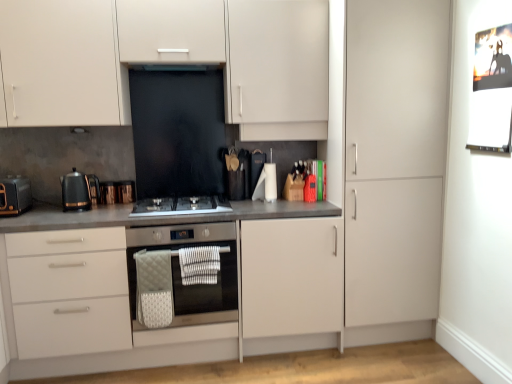
I want to click on copper metallic kettle at center-left, the first appliance from the right, so click(x=126, y=191).

Describe the element at coordinates (180, 272) in the screenshot. I see `stainless steel oven at center` at that location.

The width and height of the screenshot is (512, 384). I want to click on matte black toaster at left, the first kitchen appliance when ordered from left to right, so click(15, 196).

This screenshot has height=384, width=512. Describe the element at coordinates (395, 158) in the screenshot. I see `matte white cabinet at right` at that location.

The image size is (512, 384). What do you see at coordinates (181, 205) in the screenshot? I see `black glass gas stove at center` at bounding box center [181, 205].

Find the location of `black glass exhaust hood at upper center`. black glass exhaust hood at upper center is located at coordinates (175, 67).

Can you tell me how much white textured cloth at lower center and metallic silver bulletin board at upper right differ in facing direction?

There is a 90.8-degree angle between the facing directions of white textured cloth at lower center and metallic silver bulletin board at upper right.

From the image's perspective, which one is positioned higher, white textured cloth at lower center or metallic silver bulletin board at upper right?

metallic silver bulletin board at upper right, from the image's perspective.

Does white textured cloth at lower center appear on the right side of metallic silver bulletin board at upper right?

Incorrect, white textured cloth at lower center is not on the right side of metallic silver bulletin board at upper right.

Does white textured cloth at lower center have a greater width compared to metallic silver bulletin board at upper right?

Yes, white textured cloth at lower center is wider than metallic silver bulletin board at upper right.

Looking at this image, from the image's perspective, which one is positioned lower, white textured cloth at lower center or matte white cabinet at right?

white textured cloth at lower center is shown below in the image.

Can you confirm if white textured cloth at lower center is positioned to the right of matte white cabinet at right?

No, white textured cloth at lower center is not to the right of matte white cabinet at right.

Is point (190, 271) farther from camera compared to point (406, 14)?

No, it is in front of (406, 14).

Is white textured cloth at lower center closer to the viewer compared to matte white cabinet at right?

No, it is not.

You are a GUI agent. You are given a task and a screenshot of the screen. Output one action in this format:
    pyautogui.click(x=<x>, y=<y>)
    Task: Click on the 1st kitchen appliance to the left of the black glass gas stove at center, starting your count from the anchor
    
    Given the screenshot: What is the action you would take?
    pyautogui.click(x=78, y=191)

Is black plastic kettle at left, the 1th kitchen appliance when ordered from right to left, positioned with its back to black glass gas stove at center?

No, black glass gas stove at center is not at the back of black plastic kettle at left, the 1th kitchen appliance when ordered from right to left.

Which point is more distant from viewer, (70, 173) or (158, 200)?

The point (158, 200) is behind.

Which is in front, point (134, 195) or point (208, 67)?

Point (208, 67)

Is copper metallic kettle at center-left, arranged as the second appliance when viewed from the left, turned away from black glass exhaust hood at upper center?

No, copper metallic kettle at center-left, arranged as the second appliance when viewed from the left,'s orientation is not away from black glass exhaust hood at upper center.

Considering the sizes of objects copper metallic kettle at center-left, the first appliance from the right, and black glass exhaust hood at upper center in the image provided, who is bigger, copper metallic kettle at center-left, the first appliance from the right, or black glass exhaust hood at upper center?

With larger size is black glass exhaust hood at upper center.

How different are the orientations of copper metallic kettle at center-left, arranged as the second appliance when viewed from the left, and black glass exhaust hood at upper center in degrees?

1.32 degrees separate the facing orientations of copper metallic kettle at center-left, arranged as the second appliance when viewed from the left, and black glass exhaust hood at upper center.

I want to click on cloth in front of the matte black toaster at left, arranged as the second kitchen appliance when viewed from the right, so click(199, 265).

From the image's perspective, which is below, white textured cloth at lower center or matte black toaster at left, the first kitchen appliance when ordered from left to right?

white textured cloth at lower center, from the image's perspective.

Can you confirm if white textured cloth at lower center is wider than matte black toaster at left, arranged as the second kitchen appliance when viewed from the right?

In fact, white textured cloth at lower center might be narrower than matte black toaster at left, arranged as the second kitchen appliance when viewed from the right.

Between white textured cloth at lower center and matte black toaster at left, arranged as the second kitchen appliance when viewed from the right, which one appears on the right side from the viewer's perspective?

white textured cloth at lower center.

Considering the positions of point (120, 209) and point (481, 66), is point (120, 209) closer or farther from the camera than point (481, 66)?

Clearly, point (120, 209) is more distant from the camera than point (481, 66).

Would you say matte gray countertop at center is a long distance from metallic silver bulletin board at upper right?

Yes.

Consider the image. From the image's perspective, which one is positioned higher, matte gray countertop at center or metallic silver bulletin board at upper right?

metallic silver bulletin board at upper right, from the image's perspective.

From a real-world perspective, is matte gray countertop at center positioned under metallic silver bulletin board at upper right based on gravity?

Correct, in the physical world, matte gray countertop at center is lower than metallic silver bulletin board at upper right.

From a real-world perspective, which is physically above, matte black toaster at left, the first kitchen appliance when ordered from left to right, or stainless steel oven at center?

From a 3D spatial view, matte black toaster at left, the first kitchen appliance when ordered from left to right, is above.

From the image's perspective, which is above, matte black toaster at left, the first kitchen appliance when ordered from left to right, or stainless steel oven at center?

From the image's view, matte black toaster at left, the first kitchen appliance when ordered from left to right, is above.

Looking at this image, is the surface of matte black toaster at left, the first kitchen appliance when ordered from left to right, in direct contact with stainless steel oven at center?

matte black toaster at left, the first kitchen appliance when ordered from left to right, and stainless steel oven at center are not in contact.

Does matte black toaster at left, arranged as the second kitchen appliance when viewed from the right, have a larger size compared to stainless steel oven at center?

Actually, matte black toaster at left, arranged as the second kitchen appliance when viewed from the right, might be smaller than stainless steel oven at center.

Locate an element on the screen. cloth on the left of the metallic silver bulletin board at upper right is located at coordinates (199, 265).

The height and width of the screenshot is (384, 512). Identify the location of cloth below the matte white cabinet at right (from the image's perspective). (199, 265).

Which object lies nearer to the anchor point black glass gas stove at center, matte white cabinets at upper center or black glass exhaust hood at upper center?

matte white cabinets at upper center is closer to black glass gas stove at center.

When comparing their distances from black glass gas stove at center, does stainless steel oven at center or matte white cabinet at right seem further?

matte white cabinet at right.

Which object lies further to the anchor point matte white cabinets at upper center, copper metallic kettle at center-left, the first appliance from the right, or stainless steel oven at center?

Among the two, copper metallic kettle at center-left, the first appliance from the right, is located further to matte white cabinets at upper center.

Consider the image. Which object lies nearer to the anchor point matte white cabinet at right, copper metallic toaster at left, the 1th appliance viewed from the left, or matte black toaster at left, the first kitchen appliance when ordered from left to right?

copper metallic toaster at left, the 1th appliance viewed from the left, is closer to matte white cabinet at right.

From the image, which object appears to be nearer to matte white cabinets at upper center, matte black toaster at left, arranged as the second kitchen appliance when viewed from the right, or metallic silver bulletin board at upper right?

Based on the image, matte black toaster at left, arranged as the second kitchen appliance when viewed from the right, appears to be nearer to matte white cabinets at upper center.

Looking at the image, which one is located closer to black glass gas stove at center, matte white cabinet at right or metallic silver bulletin board at upper right?

matte white cabinet at right is closer to black glass gas stove at center.

From the image, which object appears to be nearer to matte white cabinet at right, black plastic kettle at left, acting as the 2th kitchen appliance starting from the left, or stainless steel oven at center?

stainless steel oven at center is positioned closer to the anchor matte white cabinet at right.

Based on the photo, considering their positions, is matte gray countertop at center positioned further to matte white cabinets at upper center than copper metallic toaster at left, the 2th appliance viewed from the right?

The object further to matte white cabinets at upper center is copper metallic toaster at left, the 2th appliance viewed from the right.

Locate an element on the screen. Image resolution: width=512 pixels, height=384 pixels. exhaust hood between matte black toaster at left, the first kitchen appliance when ordered from left to right, and black glass gas stove at center from left to right is located at coordinates (175, 67).

Locate an element on the screen. Image resolution: width=512 pixels, height=384 pixels. cloth located between matte black toaster at left, the first kitchen appliance when ordered from left to right, and metallic silver bulletin board at upper right in the left-right direction is located at coordinates (199, 265).

Identify the location of kitchen appliance between matte black toaster at left, arranged as the second kitchen appliance when viewed from the right, and matte white cabinet at right from left to right. The image size is (512, 384). (78, 191).

Identify the location of kitchen appliance between matte black toaster at left, the first kitchen appliance when ordered from left to right, and black glass gas stove at center, in the horizontal direction. (78, 191).